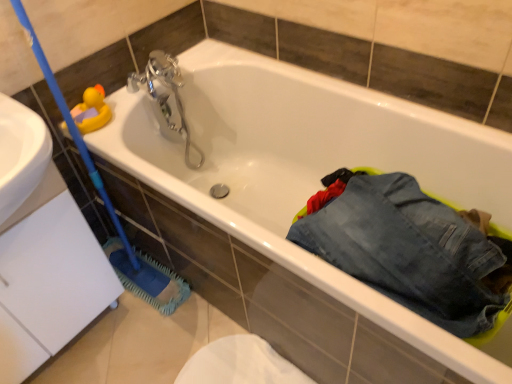
Question: Considering the positions of point (98, 104) and point (137, 264), is point (98, 104) closer or farther from the camera than point (137, 264)?

Choices:
 (A) closer
 (B) farther

Answer: (A)

Question: Considering the positions of rubber duck at upper left and blue rubber brush at left in the image, is rubber duck at upper left taller or shorter than blue rubber brush at left?

Choices:
 (A) short
 (B) tall

Answer: (A)

Question: Which object is the farthest from the silver metallic faucet at upper center?

Choices:
 (A) blue rubber brush at left
 (B) denim pants at lower right
 (C) rubber duck at upper left

Answer: (B)

Question: Estimate the real-world distances between objects in this image. Which object is farther from the denim pants at lower right?

Choices:
 (A) blue rubber brush at left
 (B) rubber duck at upper left
 (C) silver metallic faucet at upper center

Answer: (B)